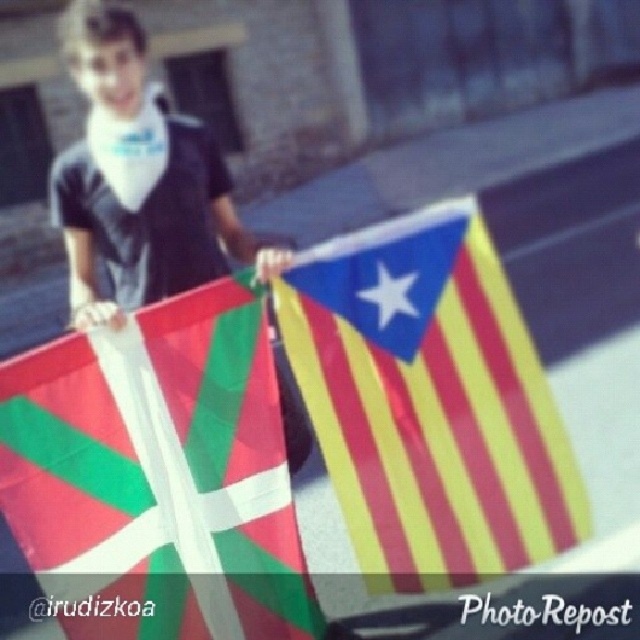
Question: Estimate the real-world distances between objects in this image. Which object is farther from the matte black shirt at upper left?

Choices:
 (A) polyester flag at center
 (B) yellow striped fabric at center

Answer: (B)

Question: Does polyester flag at center appear under yellow striped fabric at center?

Choices:
 (A) no
 (B) yes

Answer: (B)

Question: Estimate the real-world distances between objects in this image. Which object is farther from the matte black shirt at upper left?

Choices:
 (A) yellow striped fabric at center
 (B) polyester flag at center

Answer: (A)

Question: Can you confirm if yellow striped fabric at center is smaller than matte black shirt at upper left?

Choices:
 (A) yes
 (B) no

Answer: (B)

Question: Does polyester flag at center have a larger size compared to matte black shirt at upper left?

Choices:
 (A) no
 (B) yes

Answer: (B)

Question: Which of the following is the farthest from the observer?

Choices:
 (A) (19, 435)
 (B) (163, 168)

Answer: (B)